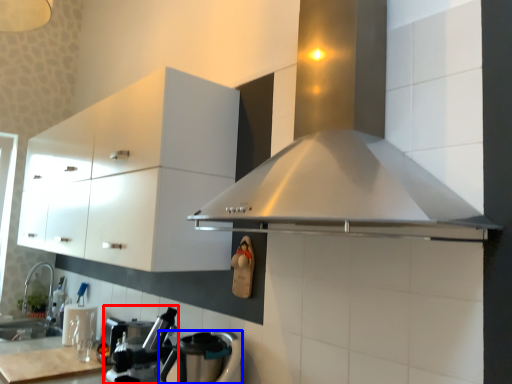
Question: Which of the following is the farthest to the observer, coffee machine (highlighted by a red box) or kitchen appliance (highlighted by a blue box)?

Choices:
 (A) coffee machine
 (B) kitchen appliance

Answer: (A)